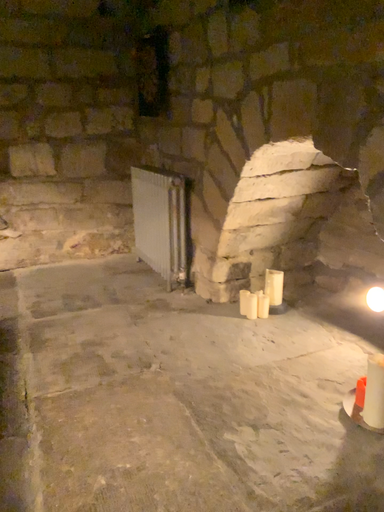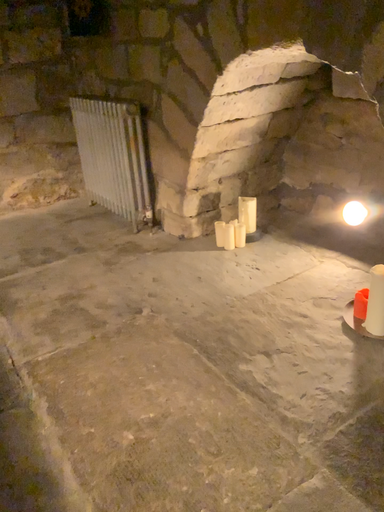
Question: How did the camera likely rotate when shooting the video?

Choices:
 (A) rotated left
 (B) rotated right

Answer: (B)